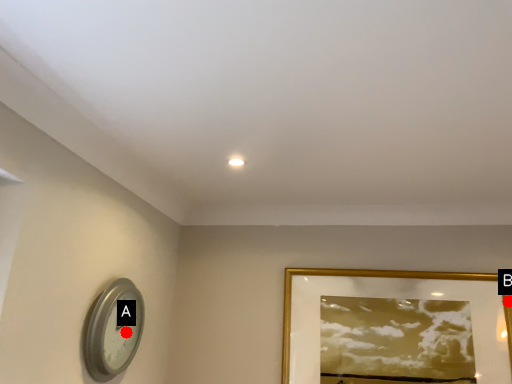
Question: Two points are circled on the image, labeled by A and B beside each circle. Which of the following is the farthest from the observer?

Choices:
 (A) A is further
 (B) B is further

Answer: (B)